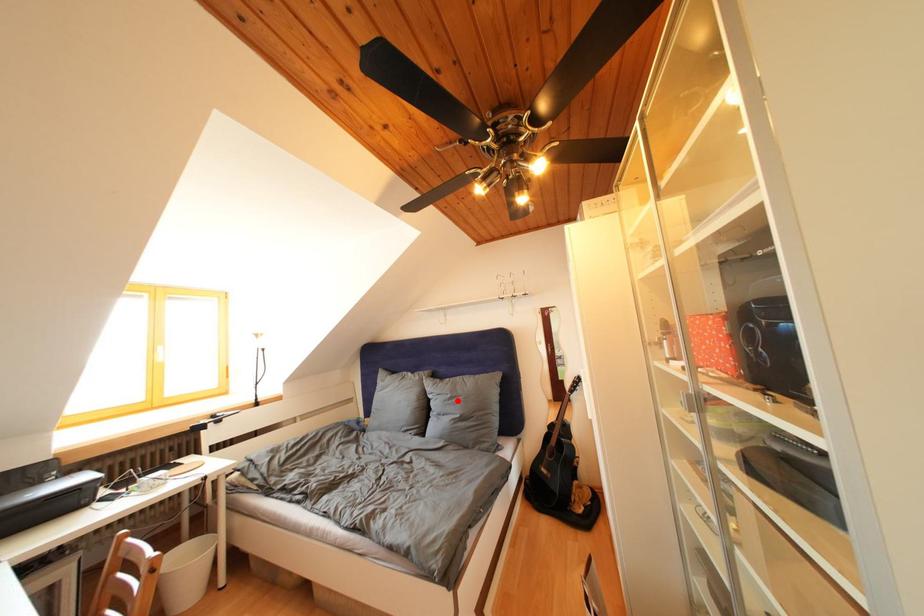
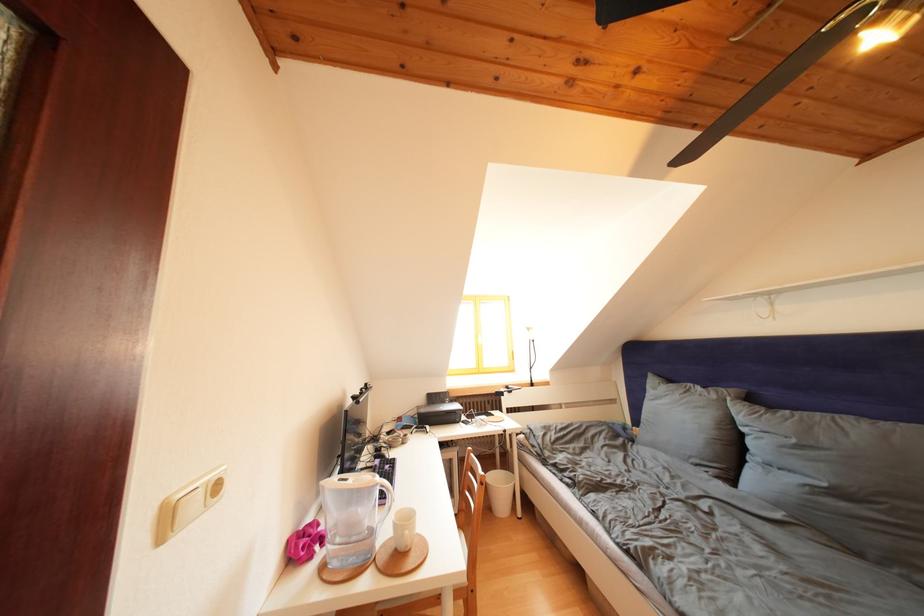
Where in the second image is the point corresponding to the highlighted location from the first image?

(801, 446)